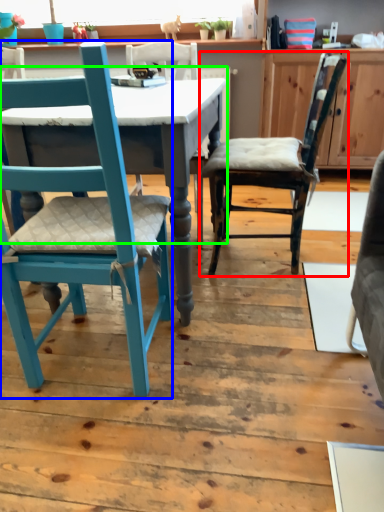
Question: Considering the real-world distances, which object is closest to chair (highlighted by a red box)? chair (highlighted by a blue box) or table (highlighted by a green box).

Choices:
 (A) chair
 (B) table

Answer: (B)